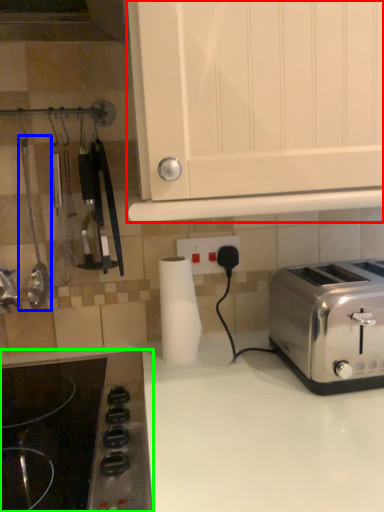
Question: Which object is the closest to the cabinetry (highlighted by a red box)? Choose among these: appliance (highlighted by a blue box) or gas stove (highlighted by a green box).

Choices:
 (A) appliance
 (B) gas stove

Answer: (B)